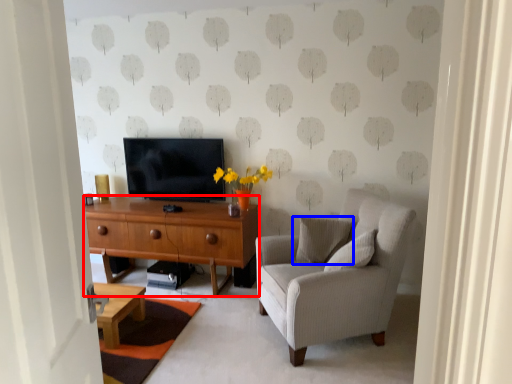
Question: Which object appears closest to the camera in this image, desk (highlighted by a red box) or pillow (highlighted by a blue box)?

Choices:
 (A) desk
 (B) pillow

Answer: (B)